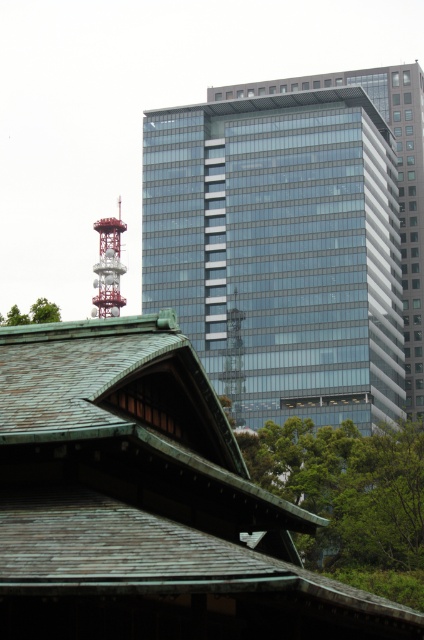
You are an architect analyzing the spatial relationship between the glassy reflective building at center and the green leafy tree at upper left in the image. Which object appears higher in the composition?

The glassy reflective building at center is positioned above the green leafy tree at upper left, making it appear higher in the composition.